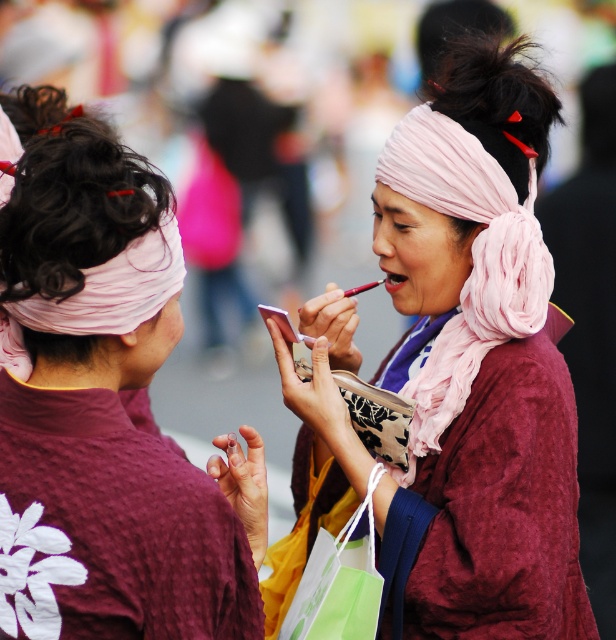
You are a costume designer preparing for a performance and need to ensure the matte pink kimono at center and the pink fabric headscarf at center are correctly sized. Based on the scene, which item is bigger?

The matte pink kimono at center is larger than the pink fabric headscarf at center.

You are a makeup artist observing the two individuals in the scene. You need to place a small decorative pin on the taller object between the pink fabric headscarf at center and the matte pink lipstick at center. Which object should you choose?

The pink fabric headscarf at center is much taller than the matte pink lipstick at center, so you should choose the pink fabric headscarf at center to place the decorative pin.

You are a makeup artist preparing for a traditional performance. You have a pink fabric headscarf at center and a matte pink lipstick at center on your table. Which item is wider?

The pink fabric headscarf at center is wider than the matte pink lipstick at center.